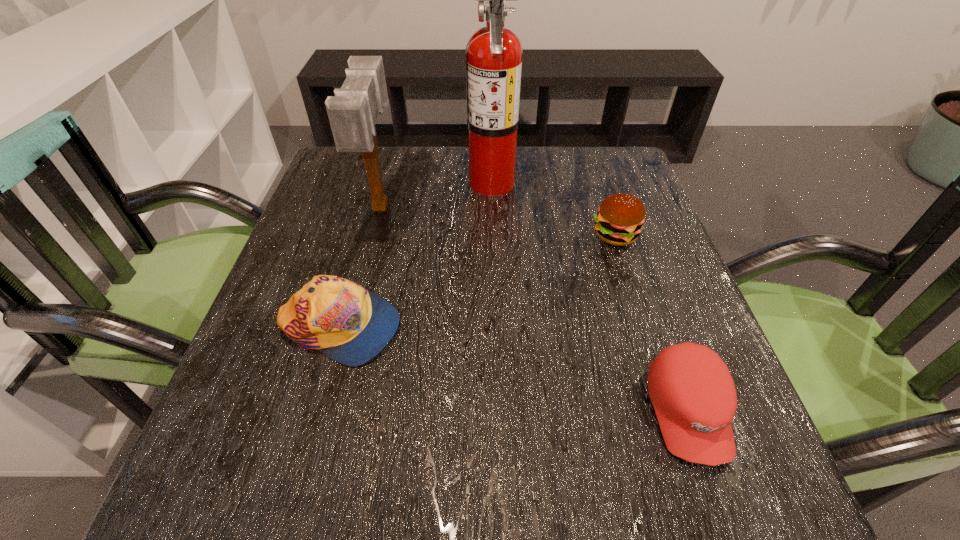
Locate an element on the screen. The image size is (960, 540). the tallest object is located at coordinates click(494, 54).

Find the location of a particular element. The width and height of the screenshot is (960, 540). fire extinguisher is located at coordinates (494, 54).

The image size is (960, 540). Find the location of `the second tallest object`. the second tallest object is located at coordinates (353, 111).

The height and width of the screenshot is (540, 960). Identify the location of hamburger. (619, 220).

This screenshot has width=960, height=540. What are the coordinates of `the left cap` in the screenshot? It's located at (347, 323).

The image size is (960, 540). I want to click on the right cap, so click(693, 394).

Identify the location of vacant space located 0.340m on the nozzle side of the third object from left to right. This screenshot has height=540, width=960. (329, 181).

This screenshot has width=960, height=540. In order to click on vacant space positioned 0.180m on the nozzle side of the third object from left to right in this screenshot , I will do point(395,181).

The height and width of the screenshot is (540, 960). What are the coordinates of `free space located on the nozzle side of the third object from left to right` in the screenshot? It's located at (354, 181).

Identify the location of vacant space situated 0.100m on the left of the mallet. (324, 207).